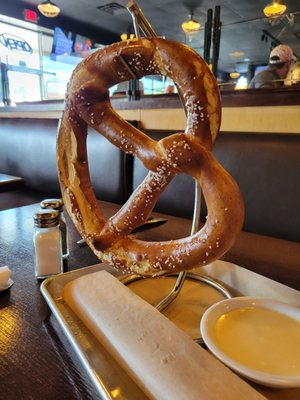
Locate an element on the screen. wood table is located at coordinates (20, 245).